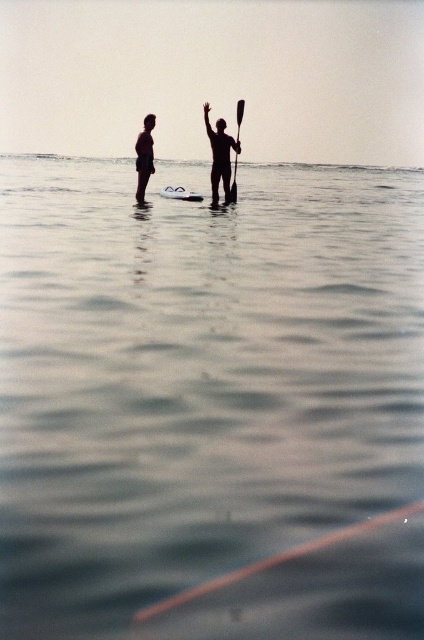
You are a photographer trying to capture the perfect shot of both the black matte surfboard at center and the black matte paddleboard at center. Since you want both objects to be clearly visible in your frame, which one should you focus on first to ensure proper alignment?

You should focus on the black matte paddleboard at center first because it is positioned to the left of the black matte surfboard at center, so adjusting focus from left to right ensures both are in frame.

You are a photographer trying to capture a clear image of both the black matte paddleboard at center and the black plastic paddle at center. Based on their positions, which object should you focus on first to ensure both are in focus?

The black matte paddleboard at center is below the black plastic paddle at center, so you should focus on the black plastic paddle at center first to ensure both are in focus.

Consider the image. You are a photographer trying to capture the black matte surfboard at center and the black matte paddleboard at center in the same frame. Which object should you move closer to in order to include both in your shot without zooming?

You should move closer to the black matte surfboard at center because it is closer to you than the black matte paddleboard at center, allowing both to be included in the frame without zooming.